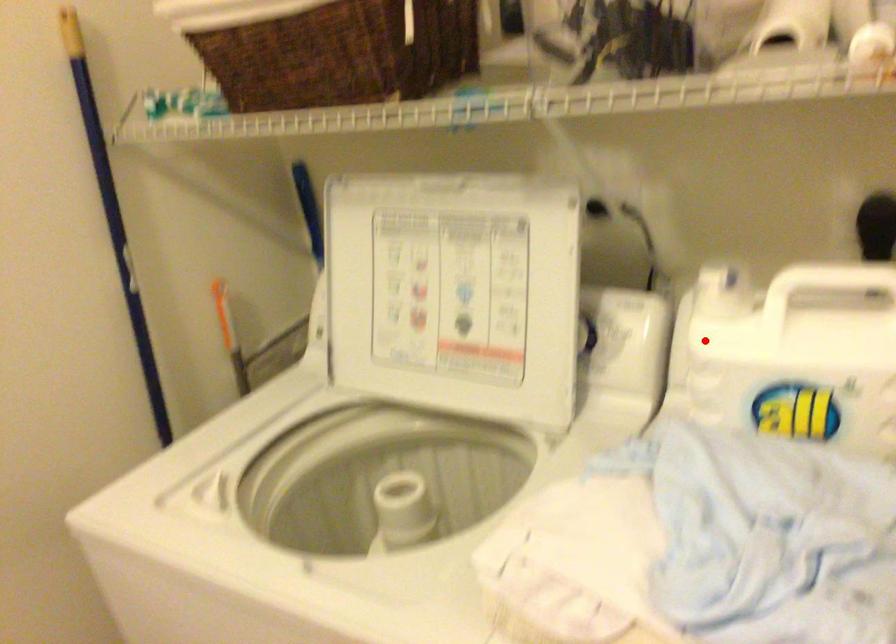
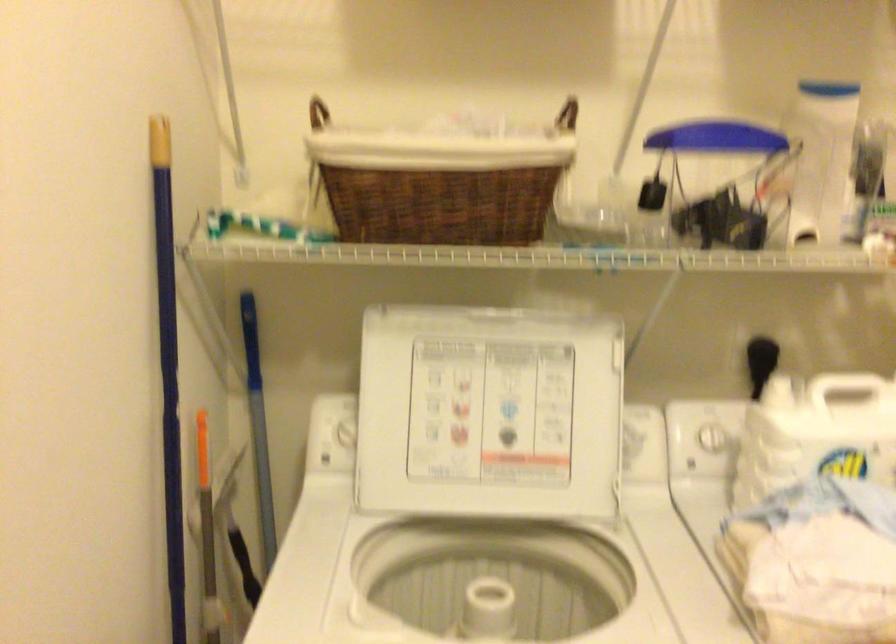
Question: A red point is marked in image1. In image2, is the corresponding 3D point closer to the camera or farther? Reply with the corresponding letter.

Choices:
 (A) The corresponding 3D point is closer.
 (B) The corresponding 3D point is farther.

Answer: (B)